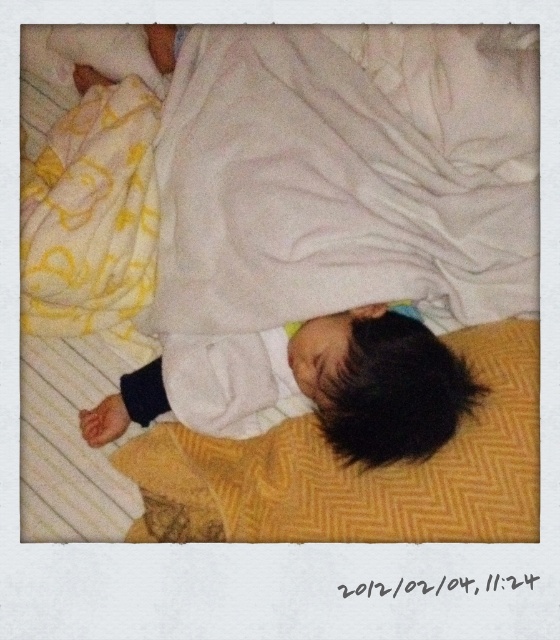
You are a photographer who wants to ensure the white soft baby at center is fully visible in the photo. Given the white soft blanket at upper center is covering part of them, can you confirm if adjusting the blanket would be necessary?

The white soft blanket at upper center is larger in size than the white soft baby at center, so adjusting it might be necessary to ensure the baby is fully visible.

You are a photographer trying to frame a shot of the white soft blanket at upper center and the white soft baby at center. Since you want to emphasize the size difference between them, which object should you zoom in on to make the size difference more apparent?

The white soft blanket at upper center has a lesser width compared to the white soft baby at center, so zooming in on the white soft baby at center would emphasize its larger size compared to the blanket.